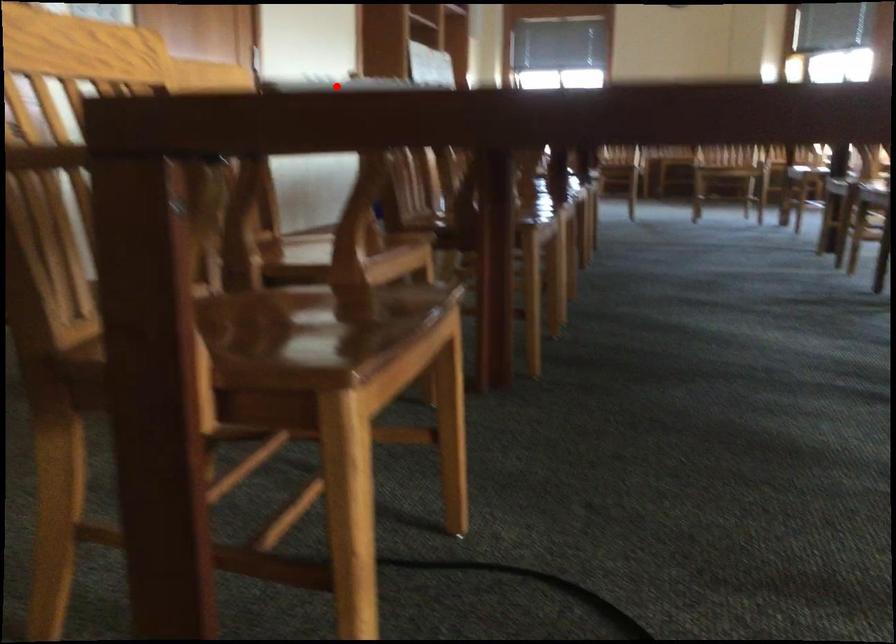
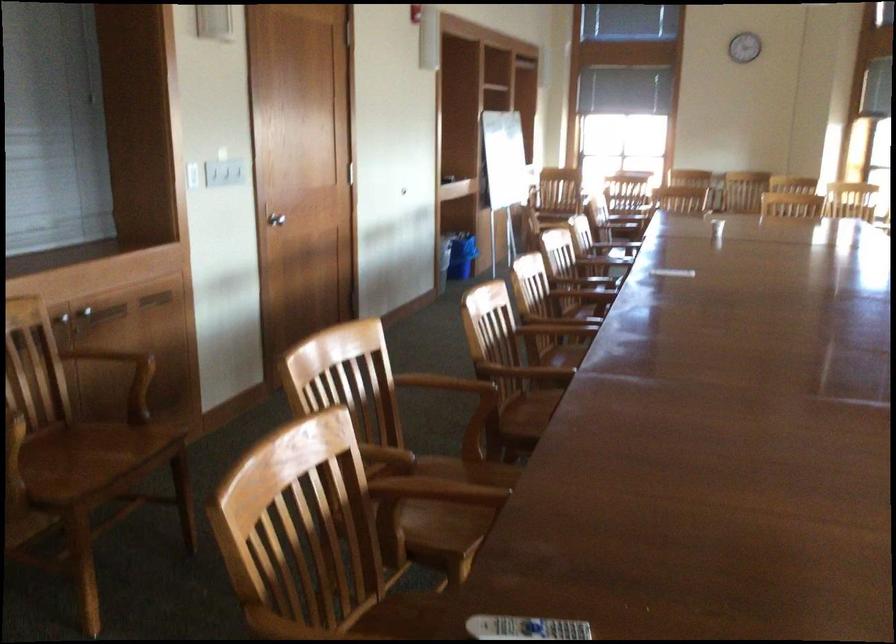
Find the pixel in the second image that matches the highlighted location in the first image.

(524, 628)